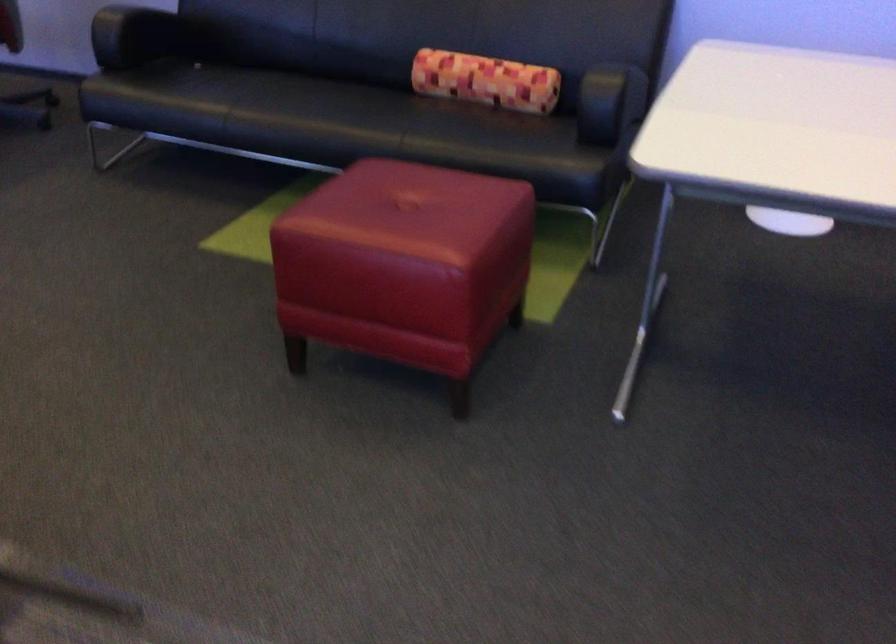
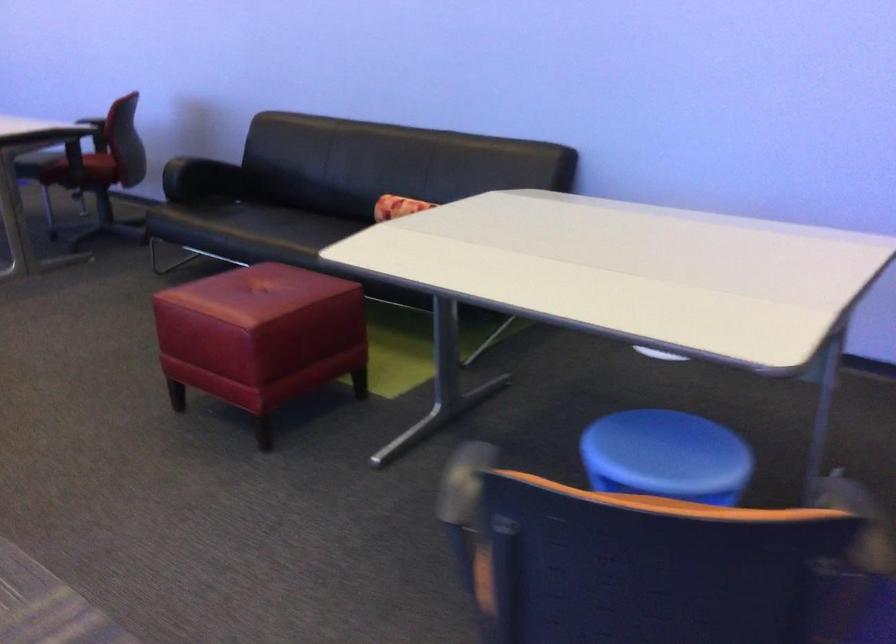
The point at (x=442, y=71) is marked in the first image. Where is the corresponding point in the second image?

(398, 205)